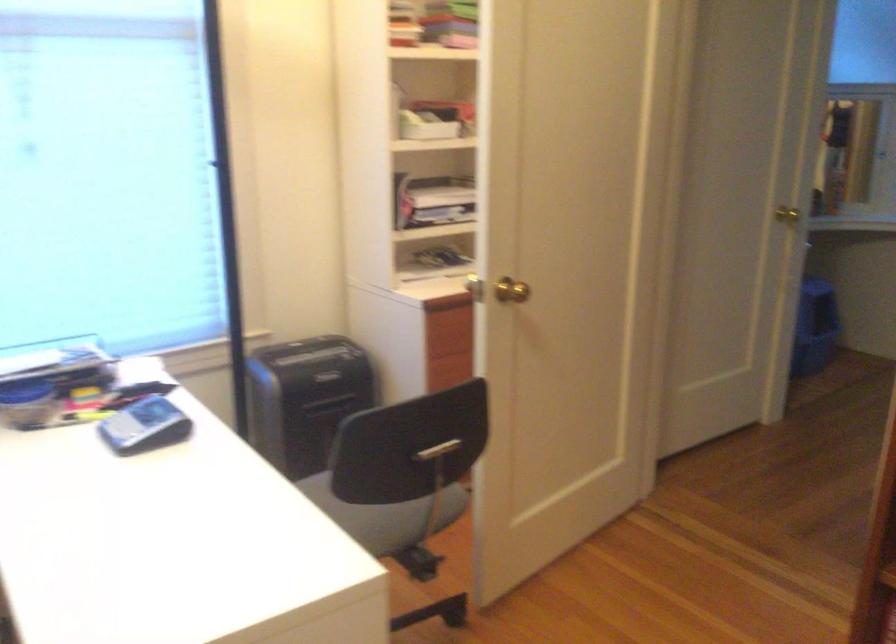
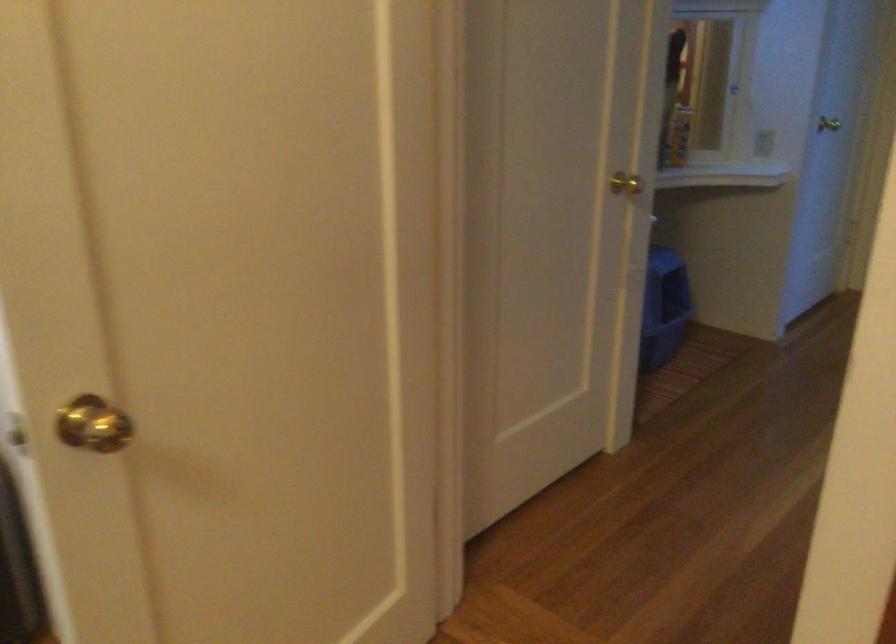
What movement of the cameraman would produce the second image?

The cameraman walked toward right, forward.